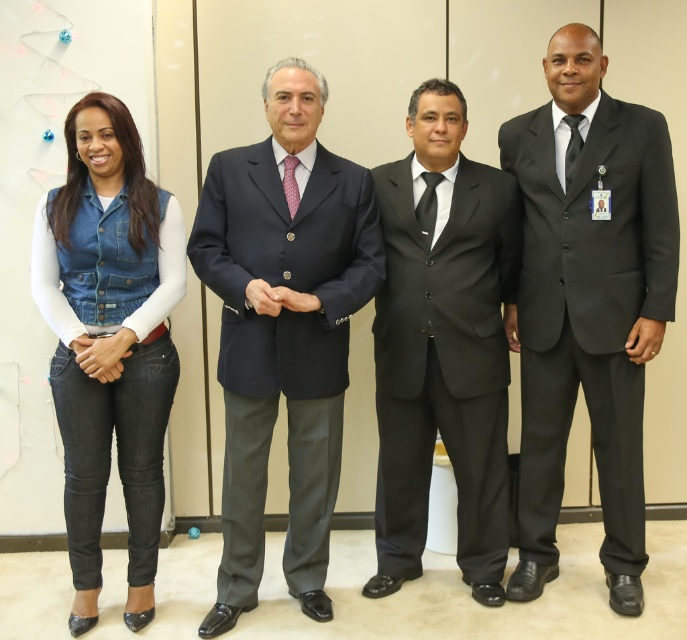
Between point (405, 554) and point (293, 192), which one is positioned in front?

Point (293, 192)

Does black satin suit at center appear on the right side of pink dotted tie at center?

Correct, you'll find black satin suit at center to the right of pink dotted tie at center.

I want to click on black satin suit at center, so click(442, 348).

Where is `black satin suit at center`? This screenshot has height=640, width=687. black satin suit at center is located at coordinates (442, 348).

Is navy blue suit at center below pink dotted tie at center?

Indeed, navy blue suit at center is positioned under pink dotted tie at center.

Is point (315, 285) less distant than point (286, 156)?

Yes, it is.

The image size is (687, 640). I want to click on navy blue suit at center, so click(x=282, y=332).

Where is `navy blue suit at center`? navy blue suit at center is located at coordinates (282, 332).

Is black satin suit at center above denim vest at left?

Indeed, black satin suit at center is positioned over denim vest at left.

Image resolution: width=687 pixels, height=640 pixels. What are the coordinates of `black satin suit at center` in the screenshot? It's located at (442, 348).